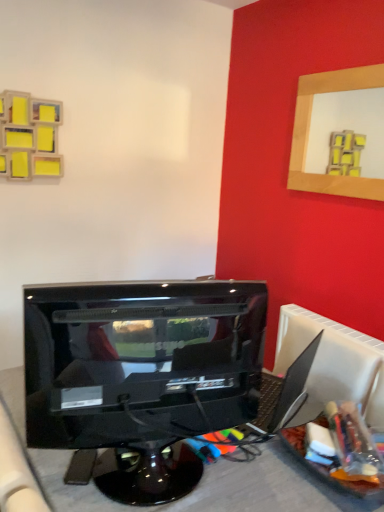
Question: Is wooden picture frame at upper right placed right next to glossy black monitor at center?

Choices:
 (A) yes
 (B) no

Answer: (B)

Question: From the image's perspective, would you say wooden picture frame at upper right is shown under glossy black monitor at center?

Choices:
 (A) yes
 (B) no

Answer: (B)

Question: Considering the relative sizes of wooden picture frame at upper right and glossy black monitor at center in the image provided, is wooden picture frame at upper right wider than glossy black monitor at center?

Choices:
 (A) no
 (B) yes

Answer: (A)

Question: Considering the relative sizes of wooden picture frame at upper right and glossy black monitor at center in the image provided, is wooden picture frame at upper right taller than glossy black monitor at center?

Choices:
 (A) yes
 (B) no

Answer: (A)

Question: Is wooden picture frame at upper right looking in the opposite direction of glossy black monitor at center?

Choices:
 (A) yes
 (B) no

Answer: (B)

Question: Could you tell me if wooden picture frame at upper right is facing glossy black monitor at center?

Choices:
 (A) yes
 (B) no

Answer: (A)

Question: Considering the relative positions of glossy black monitor at center and wooden picture frame at upper right in the image provided, is glossy black monitor at center to the right of wooden picture frame at upper right from the viewer's perspective?

Choices:
 (A) yes
 (B) no

Answer: (B)

Question: From the image's perspective, is glossy black monitor at center beneath wooden picture frame at upper right?

Choices:
 (A) no
 (B) yes

Answer: (B)

Question: Does glossy black monitor at center lie behind wooden picture frame at upper right?

Choices:
 (A) no
 (B) yes

Answer: (A)

Question: Is glossy black monitor at center located outside wooden picture frame at upper right?

Choices:
 (A) yes
 (B) no

Answer: (A)

Question: Considering the relative positions of glossy black monitor at center and wooden picture frame at upper right in the image provided, is glossy black monitor at center to the left of wooden picture frame at upper right from the viewer's perspective?

Choices:
 (A) no
 (B) yes

Answer: (B)

Question: Is glossy black monitor at center closer to the viewer compared to wooden picture frame at upper right?

Choices:
 (A) no
 (B) yes

Answer: (B)

Question: Is point (76, 370) positioned closer to the camera than point (332, 183)?

Choices:
 (A) closer
 (B) farther

Answer: (A)